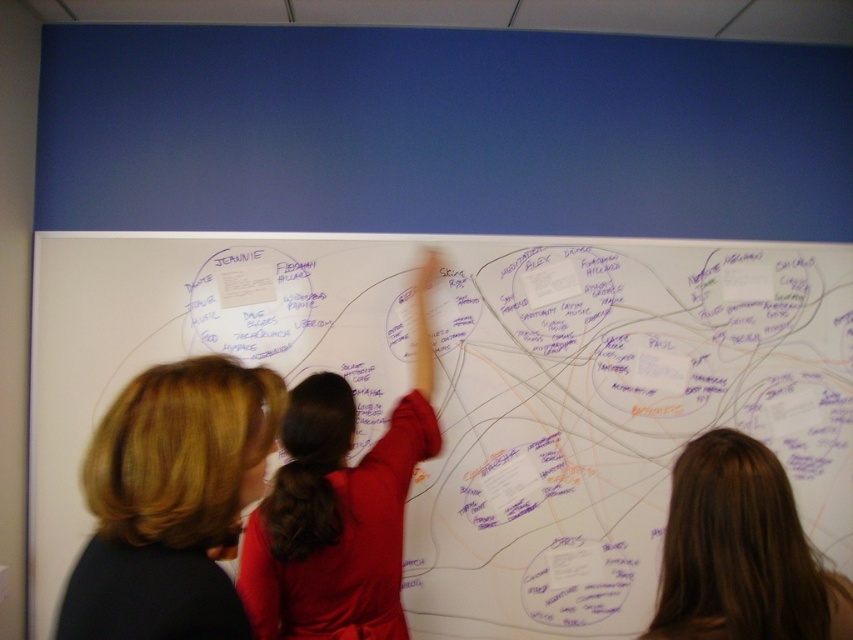
Question: Where is white matte whiteboard at center located in relation to red fabric shirt at center in the image?

Choices:
 (A) above
 (B) below

Answer: (B)

Question: Which point is farther to the camera?

Choices:
 (A) blonde hair at center
 (B) white matte whiteboard at center
 (C) red fabric shirt at center
 (D) brown hair at upper right

Answer: (B)

Question: Does white matte whiteboard at center have a greater width compared to red fabric shirt at center?

Choices:
 (A) no
 (B) yes

Answer: (B)

Question: Does white matte whiteboard at center appear on the left side of red fabric shirt at center?

Choices:
 (A) yes
 (B) no

Answer: (B)

Question: Which is nearer to the blonde hair at center?

Choices:
 (A) white matte whiteboard at center
 (B) red fabric shirt at center
 (C) brown hair at upper right

Answer: (B)

Question: Which object is the farthest from the red fabric shirt at center?

Choices:
 (A) blonde hair at center
 (B) white matte whiteboard at center

Answer: (B)